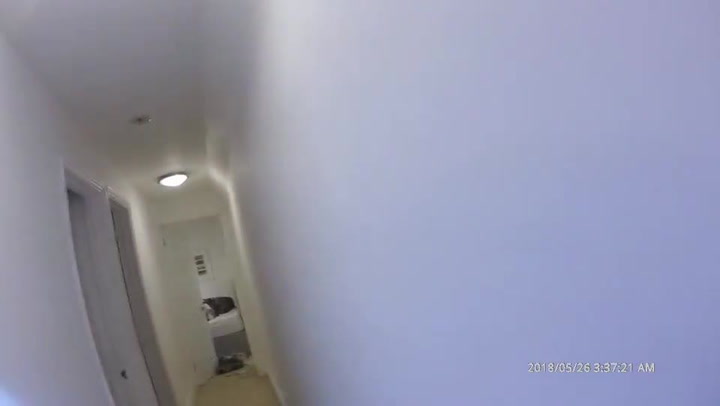
Find the location of `fire alarm`. fire alarm is located at coordinates (143, 123).